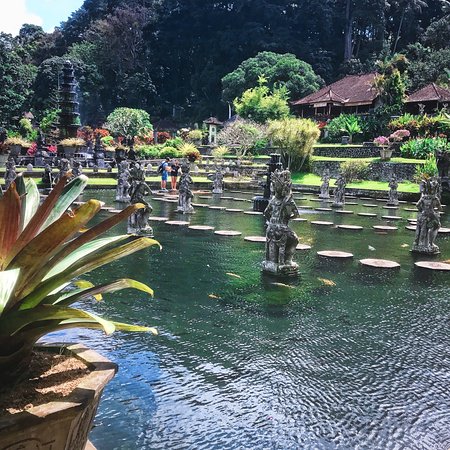
Where is `green plant leaf`? Image resolution: width=450 pixels, height=450 pixels. green plant leaf is located at coordinates (49, 208), (47, 233), (65, 248), (87, 257), (88, 264).